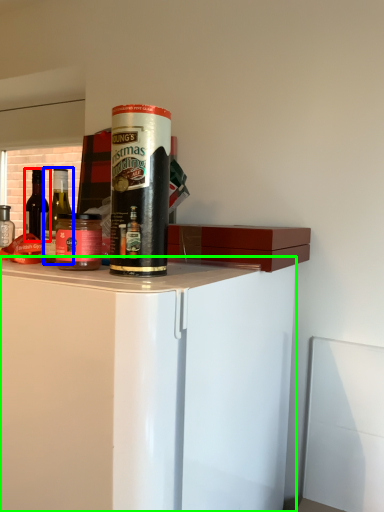
Question: Estimate the real-world distances between objects in this image. Which object is closer to bottle (highlighted by a red box), bottle (highlighted by a blue box) or cabinetry (highlighted by a green box)?

Choices:
 (A) bottle
 (B) cabinetry

Answer: (B)